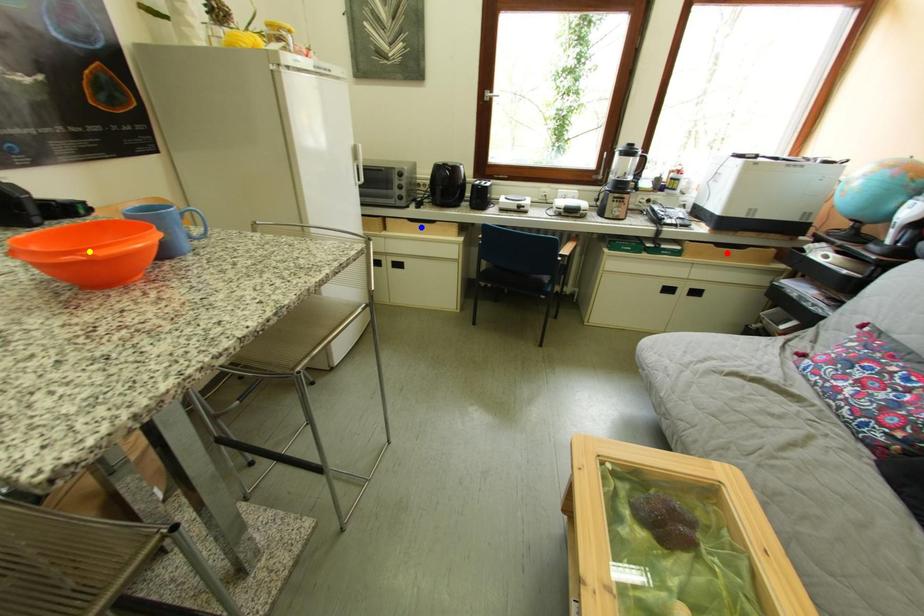
Order these from nearest to farthest:
red point
blue point
yellow point

yellow point, red point, blue point